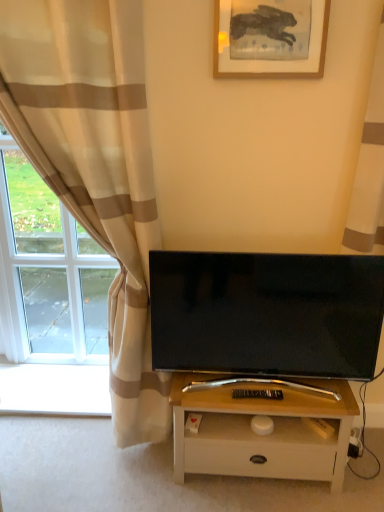
At what (x,y) coordinates should I click in order to perform the action: click on vacant area that lies between beige striped curtain at left, which is counted as the first curtain, starting from the left, and white wood table at center. Please return your answer as a coordinate pair (x, y). The height and width of the screenshot is (512, 384). Looking at the image, I should click on (104, 467).